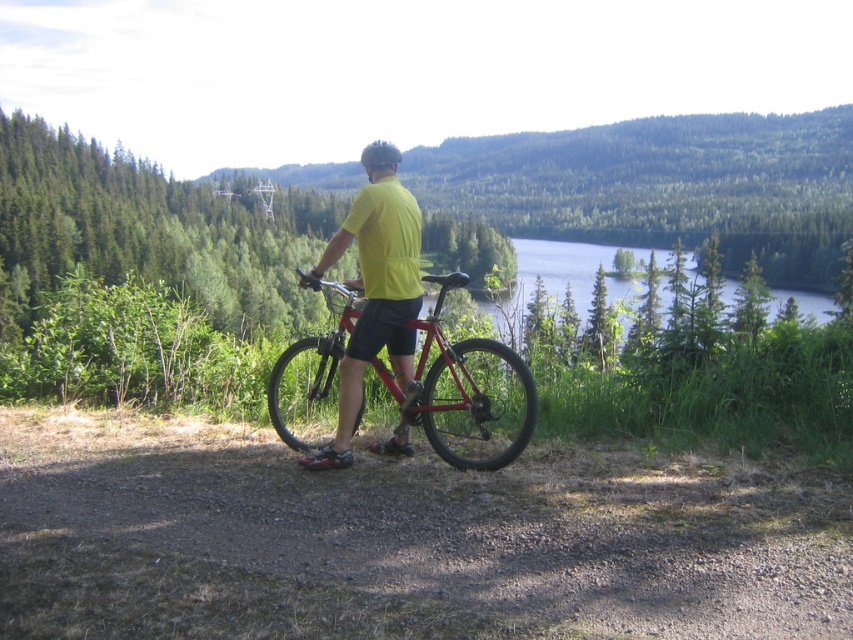
Question: Does dirt/gravel path at center appear under yellow matte shirt at center?

Choices:
 (A) yes
 (B) no

Answer: (A)

Question: Which point is closer to the camera taking this photo?

Choices:
 (A) (456, 458)
 (B) (697, 580)
 (C) (381, 168)

Answer: (B)

Question: Which is nearer to the shiny metallic bicycle at center?

Choices:
 (A) yellow matte shirt at center
 (B) dirt/gravel path at center

Answer: (A)

Question: Considering the real-world distances, which object is farthest from the shiny metallic bicycle at center?

Choices:
 (A) yellow matte shirt at center
 (B) dirt/gravel path at center

Answer: (B)

Question: Can you confirm if dirt/gravel path at center is positioned to the right of yellow matte shirt at center?

Choices:
 (A) no
 (B) yes

Answer: (B)

Question: Is dirt/gravel path at center in front of yellow matte shirt at center?

Choices:
 (A) yes
 (B) no

Answer: (A)